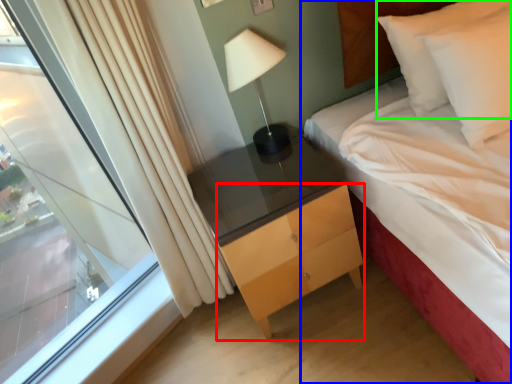
Question: Which object is the farthest from chest of drawers (highlighted by a red box)? Choose among these: bed (highlighted by a blue box) or pillow (highlighted by a green box).

Choices:
 (A) bed
 (B) pillow

Answer: (B)